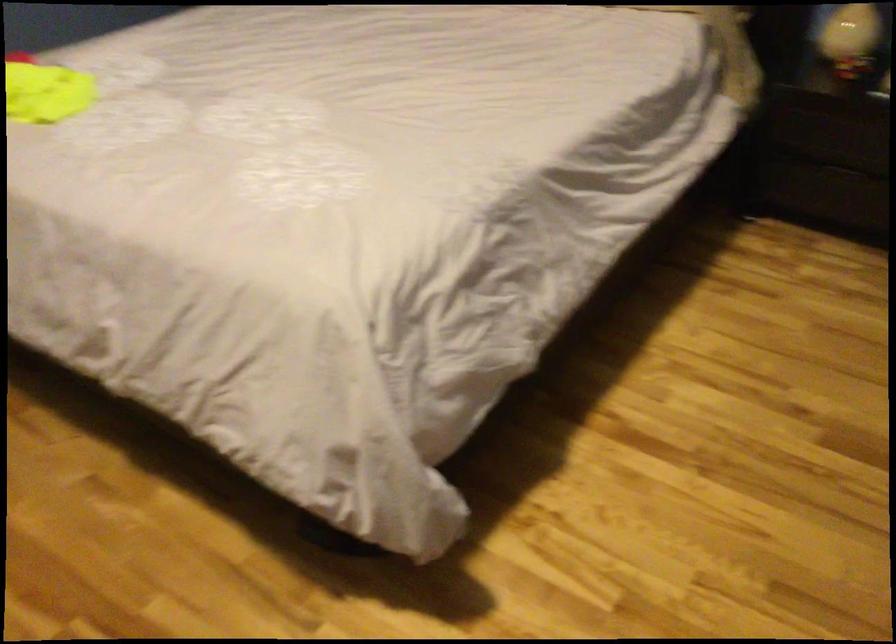
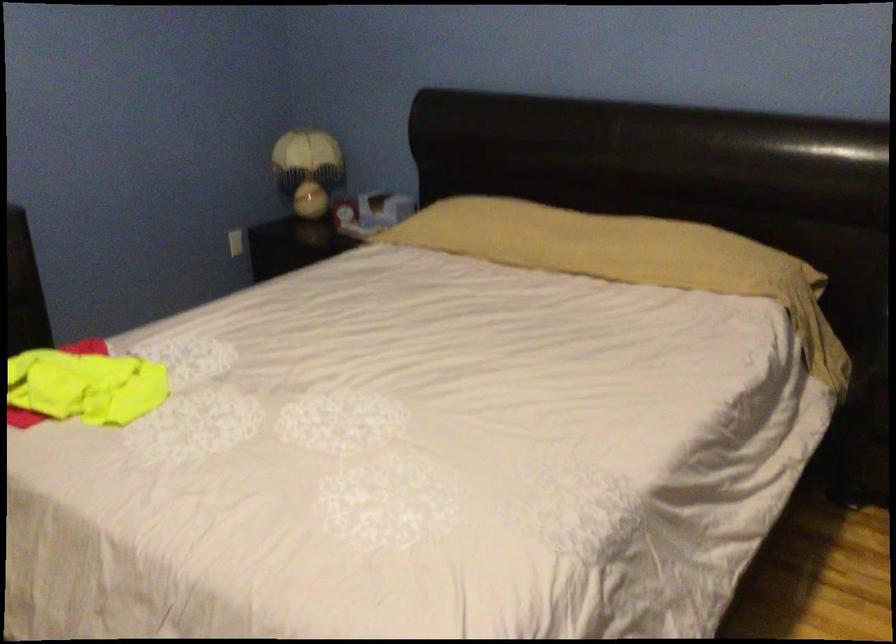
Question: How did the camera likely rotate?

Choices:
 (A) Left
 (B) Right
 (C) Up
 (D) Down

Answer: (C)